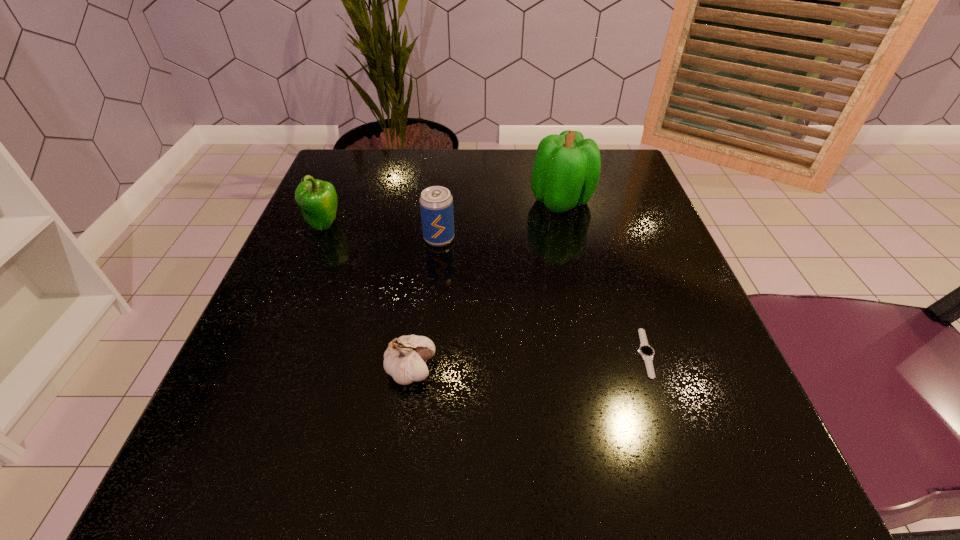
At what (x,y) coordinates should I click in order to perform the action: click on the right bell pepper. Please return your answer as a coordinate pair (x, y). Looking at the image, I should click on (566, 170).

Image resolution: width=960 pixels, height=540 pixels. I want to click on the tallest object, so click(x=566, y=170).

At what (x,y) coordinates should I click in order to perform the action: click on the shorter bell pepper. Please return your answer as a coordinate pair (x, y). Looking at the image, I should click on (317, 199).

Where is `the left bell pepper`? This screenshot has width=960, height=540. the left bell pepper is located at coordinates (317, 199).

Where is `beer can`? beer can is located at coordinates (436, 203).

Find the location of a particular element. garlic is located at coordinates (404, 360).

Where is `watch`? This screenshot has height=540, width=960. watch is located at coordinates (646, 352).

I want to click on vacant region located on the back of the taller bell pepper, so click(550, 152).

In order to click on vacant space located 0.210m on the back of the shorter bell pepper in this screenshot , I will do `click(350, 161)`.

You are a GUI agent. You are given a task and a screenshot of the screen. Output one action in this format:
    pyautogui.click(x=<x>, y=<y>)
    Task: Click on the vacant region located 0.190m on the front of the beer can
    
    Given the screenshot: What is the action you would take?
    pyautogui.click(x=430, y=329)